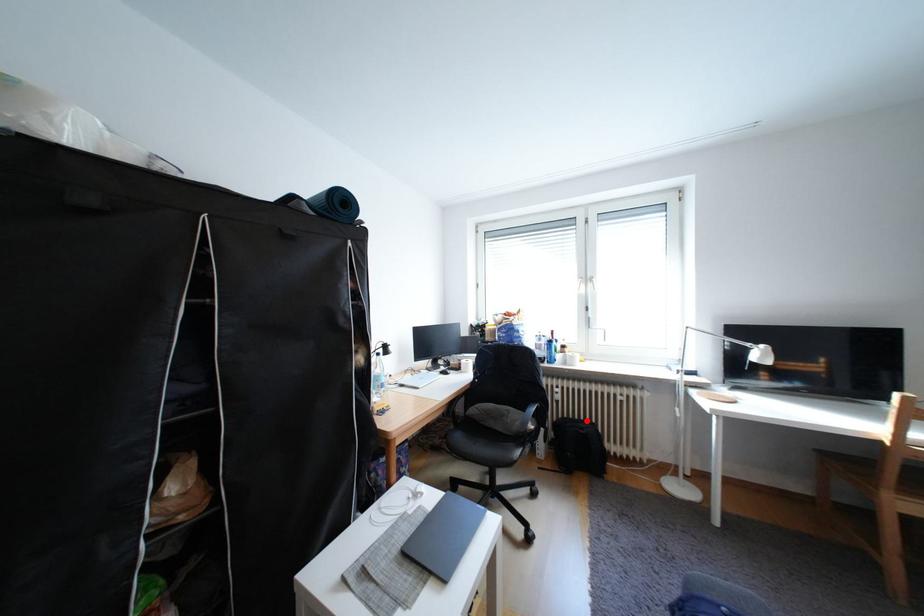
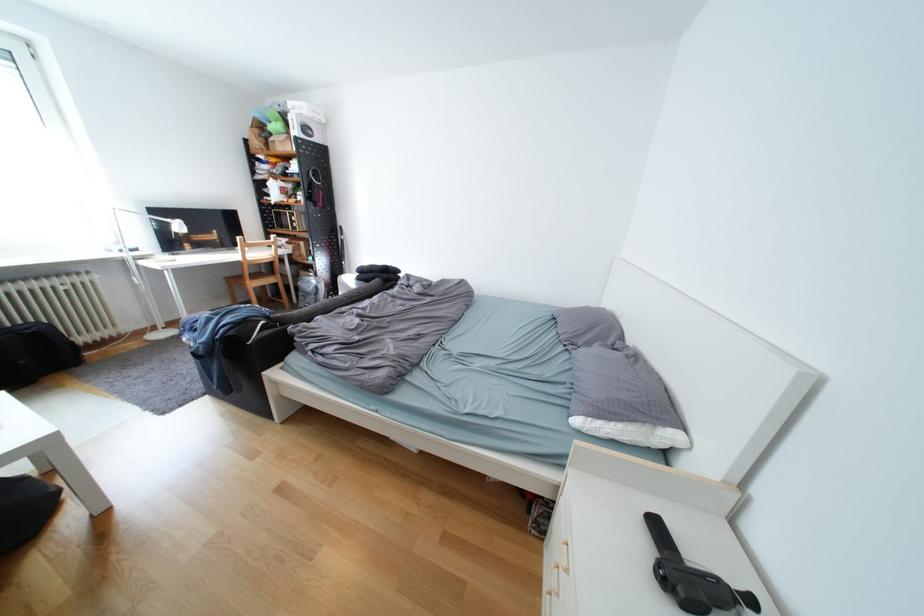
Question: A red point is marked in image1. In image2, is the corresponding 3D point closer to the camera or farther? Reply with the corresponding letter.

Choices:
 (A) The corresponding 3D point is closer.
 (B) The corresponding 3D point is farther.

Answer: (B)